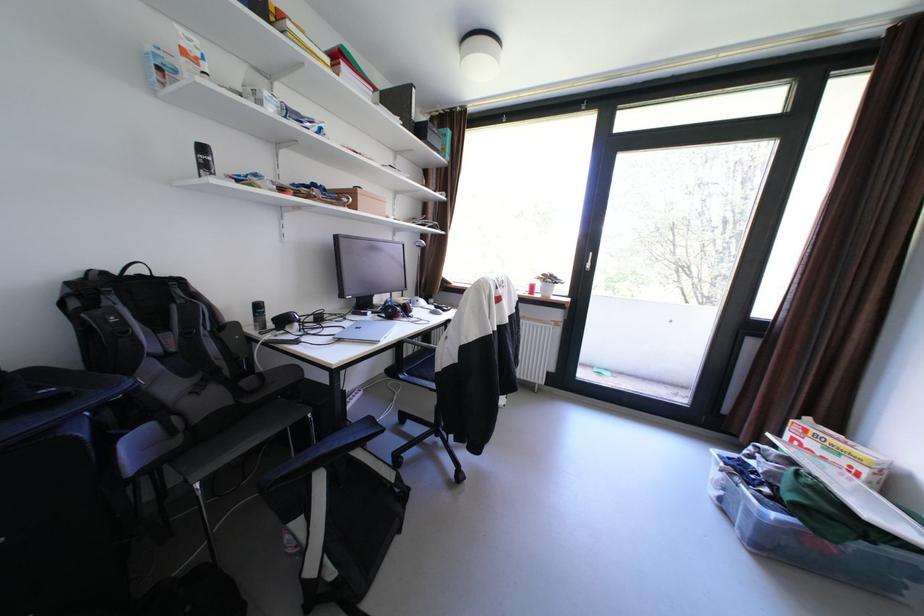
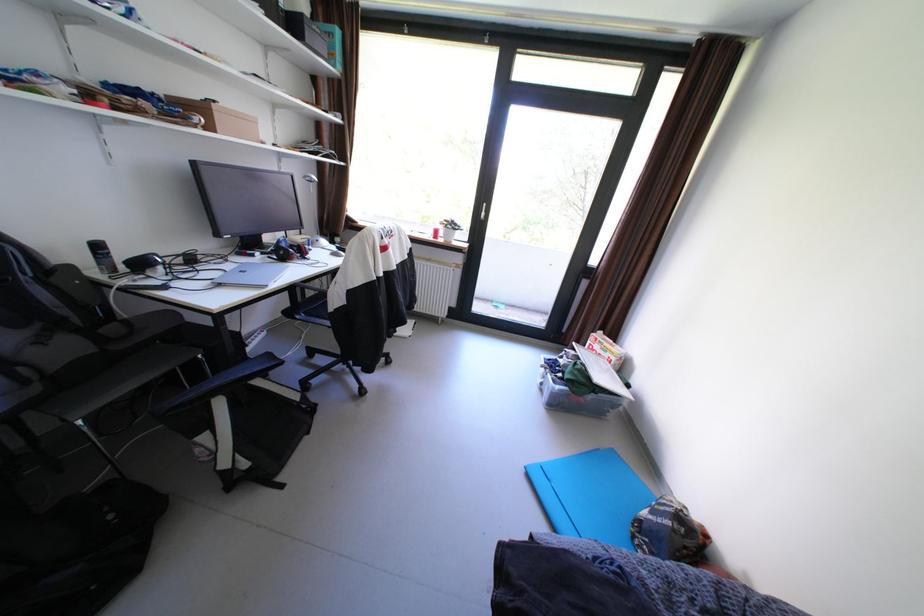
Locate, in the second image, the point that corresponds to the point at 383,313 in the first image.

(274, 254)